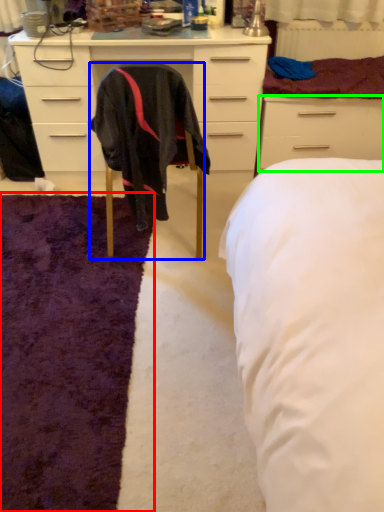
Question: Which is farther away from mat (highlighted by a red box)? chair (highlighted by a blue box) or drawer (highlighted by a green box)?

Choices:
 (A) chair
 (B) drawer

Answer: (B)